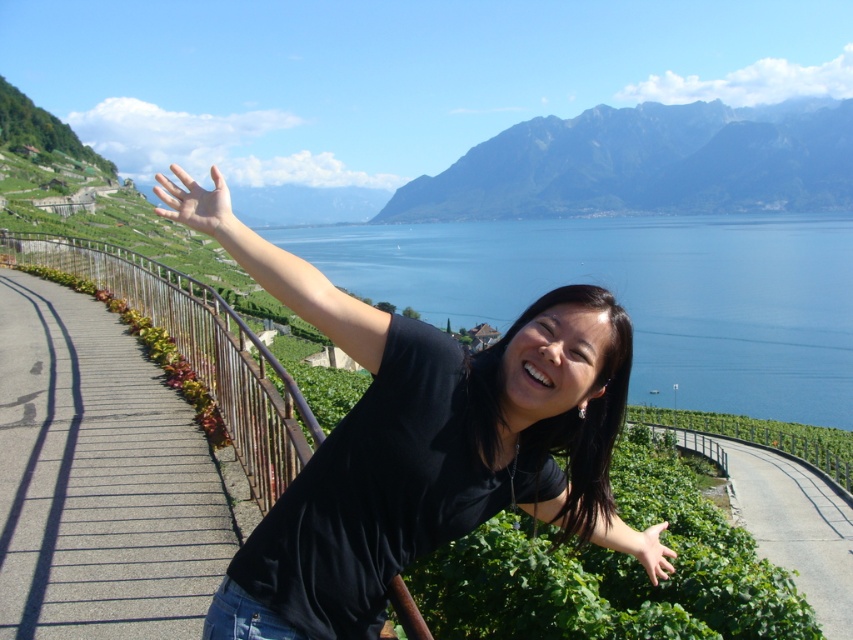
Question: Is black matte arm at lower center bigger than matte skin hand at upper center?

Choices:
 (A) no
 (B) yes

Answer: (A)

Question: Which point appears farthest from the camera in this image?

Choices:
 (A) (602, 157)
 (B) (596, 516)
 (C) (656, 627)
 (D) (171, 192)

Answer: (A)

Question: Does blue water at center have a smaller size compared to rugged granite mountain at upper center?

Choices:
 (A) no
 (B) yes

Answer: (A)

Question: Which point is closer to the camera?

Choices:
 (A) [x=537, y=198]
 (B) [x=689, y=477]
 (C) [x=512, y=476]
 (D) [x=173, y=163]

Answer: (C)

Question: Does green leafy hedge at lower center appear on the right side of matte black arm at upper center?

Choices:
 (A) no
 (B) yes

Answer: (B)

Question: Based on their relative distances, which object is nearer to the black matte shirt at center?

Choices:
 (A) matte skin hand at lower center
 (B) rugged granite mountain at upper center
 (C) black matte arm at lower center
 (D) blue water at center

Answer: (C)